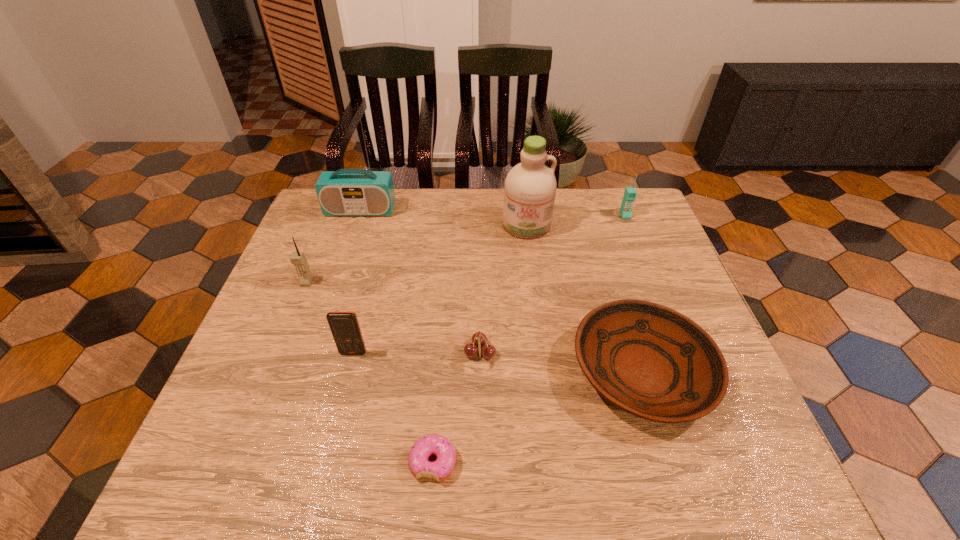
In order to click on free space at the left edge of the desktop in this screenshot , I will do `click(299, 237)`.

In the image, there is a desktop. Where is `vacant space at the right edge`? The height and width of the screenshot is (540, 960). vacant space at the right edge is located at coordinates (619, 271).

The image size is (960, 540). In the image, there is a desktop. Identify the location of free space at the far right corner. (642, 224).

In the image, there is a desktop. Identify the location of vacant space at the near right corner. (767, 468).

This screenshot has width=960, height=540. In order to click on free space between the radio receiver and the fifth nearest object in this screenshot , I will do `click(333, 246)`.

Where is `vacant space that's between the fifth object from right to left and the fourth object from right to left`? vacant space that's between the fifth object from right to left and the fourth object from right to left is located at coordinates (457, 408).

You are a GUI agent. You are given a task and a screenshot of the screen. Output one action in this format:
    pyautogui.click(x=<x>, y=<y>)
    Task: Click on the free area in between the radio receiver and the plate
    
    Given the screenshot: What is the action you would take?
    pyautogui.click(x=501, y=291)

Identify the location of vacant space in between the fourth object from left to right and the fifth nearest object. The image size is (960, 540). (370, 372).

What are the coordinates of `free space between the second nearest cellular telephone and the cherry` in the screenshot? It's located at (394, 318).

Where is `empty space that is in between the cleansing agent and the plate`? The width and height of the screenshot is (960, 540). empty space that is in between the cleansing agent and the plate is located at coordinates (585, 298).